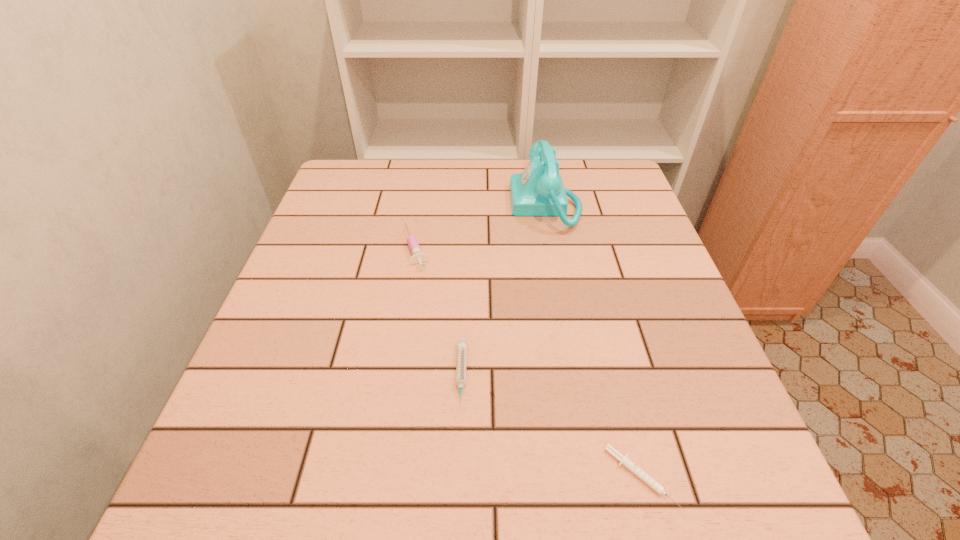
This screenshot has height=540, width=960. I want to click on empty location between the tallest object and the farthest syringe, so click(481, 226).

What are the coordinates of `free spot between the nearest object and the second nearest syringe` in the screenshot? It's located at (551, 427).

Where is `free space between the telephone and the shortest syringe`? The height and width of the screenshot is (540, 960). free space between the telephone and the shortest syringe is located at coordinates (593, 341).

Locate an element on the screen. This screenshot has width=960, height=540. free space between the second syringe from right to left and the third shortest object is located at coordinates (439, 312).

Image resolution: width=960 pixels, height=540 pixels. Find the location of `free point between the tallest syringe and the tallest object`. free point between the tallest syringe and the tallest object is located at coordinates (481, 226).

Identify the location of the closest object to the second nearest object. (417, 257).

In order to click on the closest object relative to the nearest syringe in this screenshot , I will do `click(462, 344)`.

Identify which syringe is the second nearest to the second farthest syringe. Please provide its 2D coordinates. Your answer should be formatted as a tuple, i.e. [(x, y)], where the tuple contains the x and y coordinates of a point satisfying the conditions above.

[(658, 488)]

Select which syringe appears as the closest to the rightmost syringe. Please provide its 2D coordinates. Your answer should be formatted as a tuple, i.e. [(x, y)], where the tuple contains the x and y coordinates of a point satisfying the conditions above.

[(462, 344)]

I want to click on free location that satisfies the following two spatial constraints: 1. on the dial of the telephone; 2. at the needle end of the third tallest object, so click(x=577, y=376).